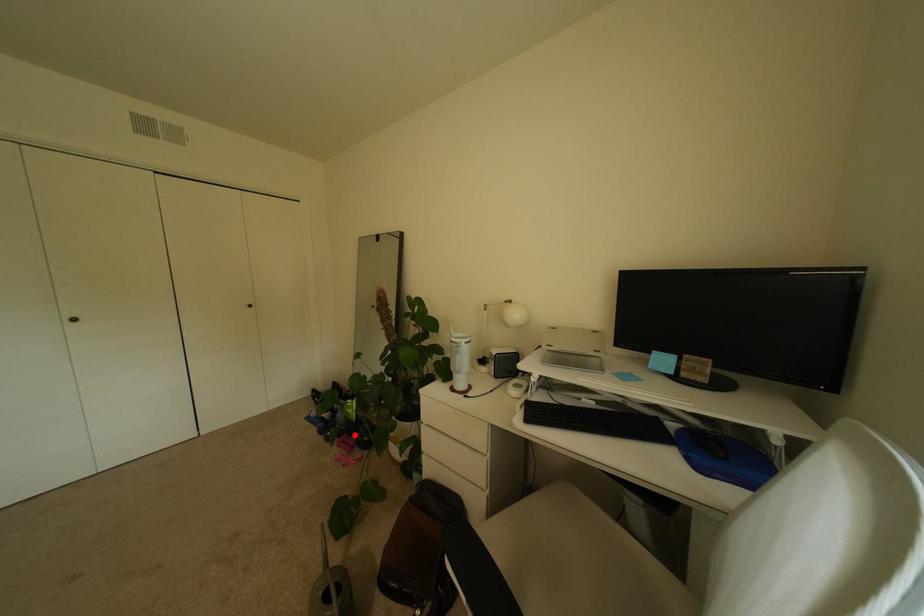
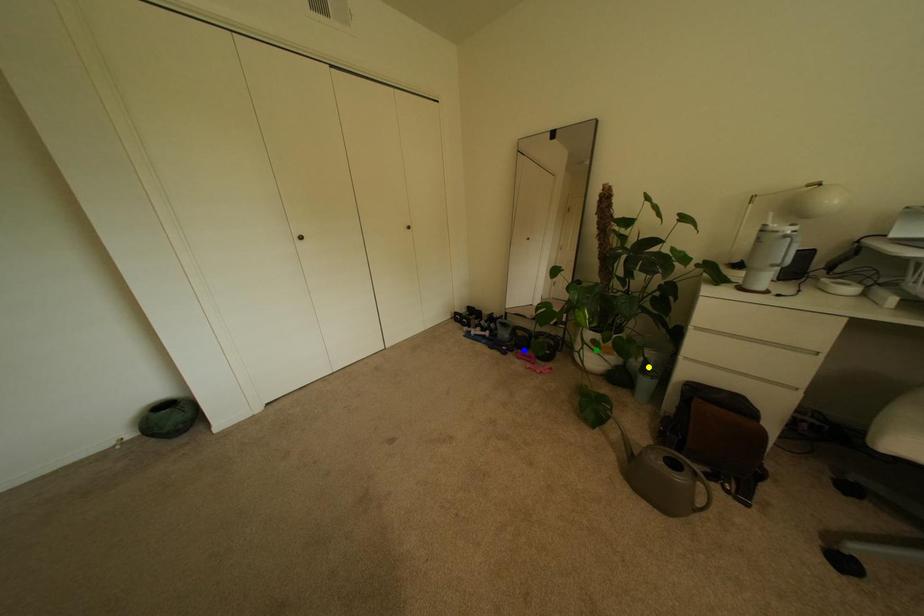
Question: I am providing you with two images of the same scene from different viewpoints. A red point is marked on the first image. You are given multiple points on the second image. Which point in image 2 represents the same 3d spot as the red point in image 1?

Choices:
 (A) yellow point
 (B) green point
 (C) blue point

Answer: (C)